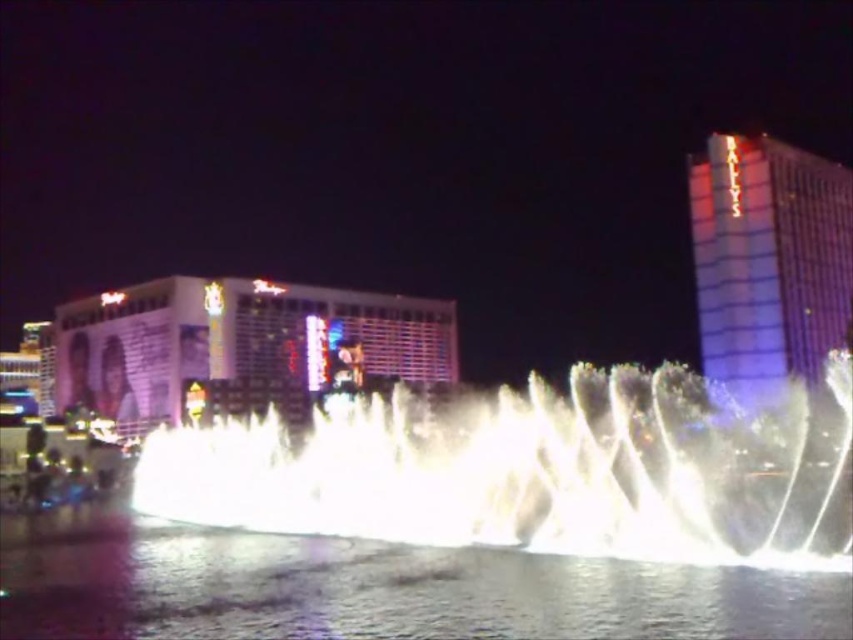
Question: Estimate the real-world distances between objects in this image. Which object is closer to the white frothy water at center?

Choices:
 (A) metallic glass building at upper right
 (B) clear liquid water at center
 (C) matte glass hotel at center

Answer: (B)

Question: Where is matte glass hotel at center located in relation to metallic glass building at upper right in the image?

Choices:
 (A) below
 (B) above

Answer: (A)

Question: Which object is closer to the camera taking this photo?

Choices:
 (A) matte glass hotel at center
 (B) metallic glass building at upper right

Answer: (B)

Question: Is white frothy water at center to the right of matte glass hotel at center from the viewer's perspective?

Choices:
 (A) no
 (B) yes

Answer: (B)

Question: Is clear liquid water at center below matte glass hotel at center?

Choices:
 (A) yes
 (B) no

Answer: (A)

Question: Which point appears farthest from the camera in this image?

Choices:
 (A) (367, 408)
 (B) (123, 369)

Answer: (B)